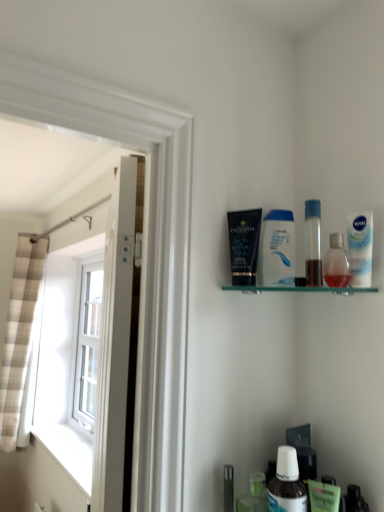
What are the coordinates of `vacant region above clear glass shelf at upper right (from a real-world perspective)` in the screenshot? It's located at (303, 279).